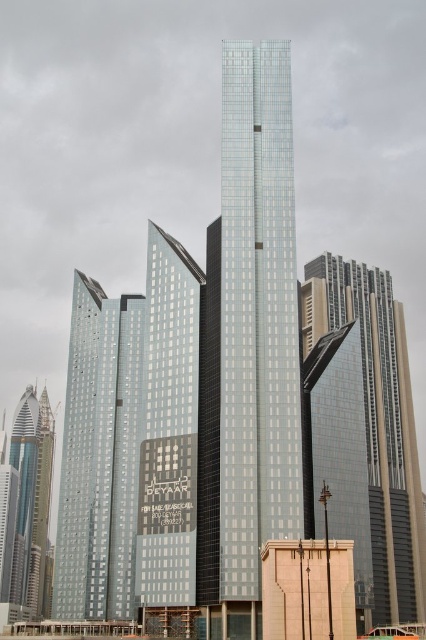
You are standing in front of the glassy metallic skyscraper at center. Which direction should you face to see the metallic glass skyscraper at left?

You should face to the left to see the metallic glass skyscraper at left since it is located to the left of the glassy metallic skyscraper at center.

You are standing at the point marked at (x=114, y=330). You want to walk to the central light blue glass building. Which direction should you go to reach it?

Since the point marked at (x=114, y=330) is 305.54 feet away from the central light blue glass building, you should move towards the central light blue glass building to reach it.